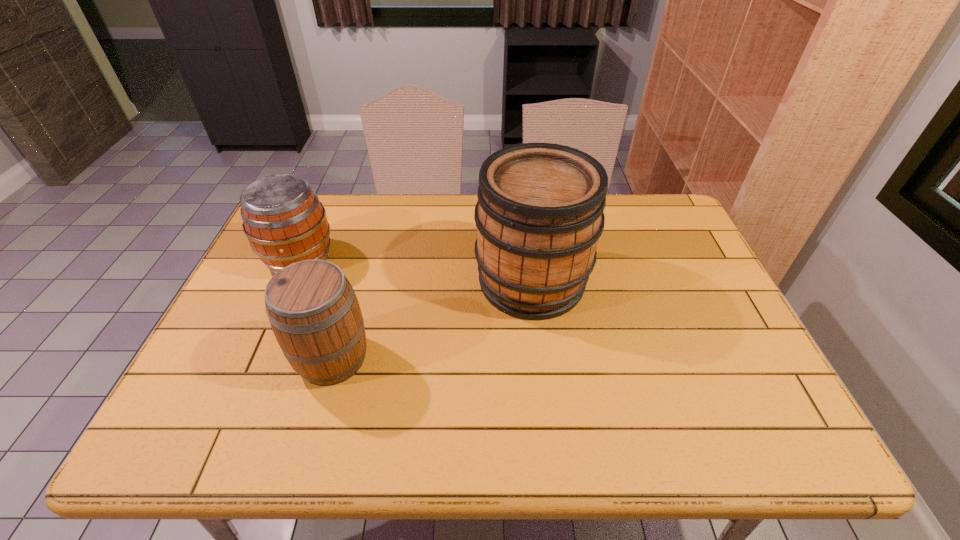
Where is `free location that satisfies the following two spatial constraints: 1. on the back side of the tallest cider; 2. on the right side of the nearest cider`? The height and width of the screenshot is (540, 960). free location that satisfies the following two spatial constraints: 1. on the back side of the tallest cider; 2. on the right side of the nearest cider is located at coordinates (355, 281).

I want to click on vacant area that satisfies the following two spatial constraints: 1. on the back side of the nearest cider; 2. on the right side of the tallest cider, so click(355, 281).

This screenshot has height=540, width=960. I want to click on free space that satisfies the following two spatial constraints: 1. on the back side of the nearest object; 2. on the right side of the tallest object, so click(355, 281).